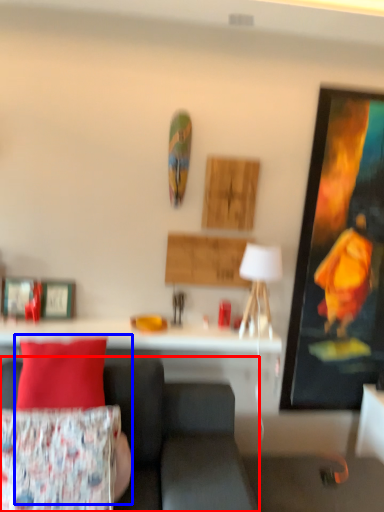
Question: Which of the following is the farthest to the observer, studio couch (highlighted by a red box) or person (highlighted by a blue box)?

Choices:
 (A) studio couch
 (B) person

Answer: (B)